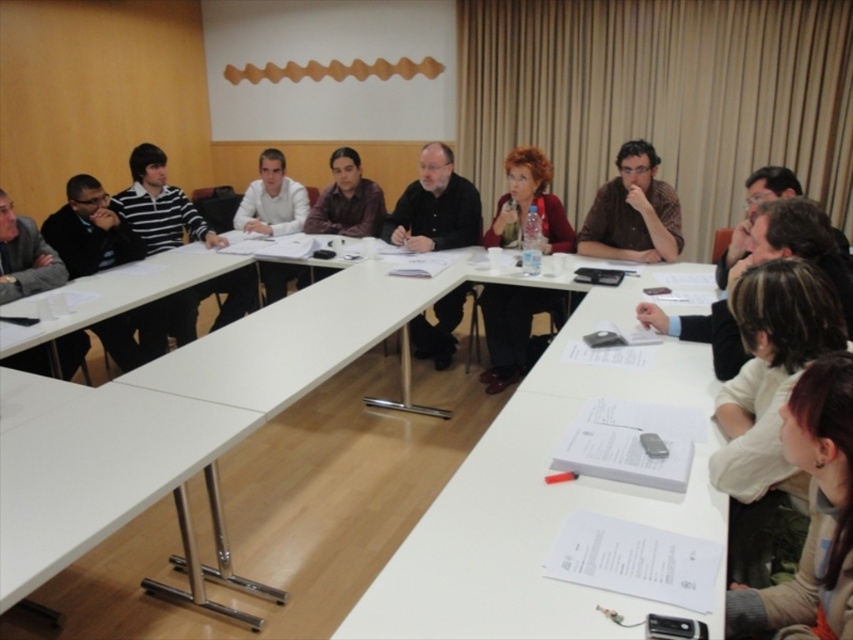
Who is higher up, white glossy table at center or matte black jacket at left?

matte black jacket at left

Is white glossy table at center above matte black jacket at left?

Incorrect, white glossy table at center is not positioned above matte black jacket at left.

Where is `white glossy table at center`? This screenshot has width=853, height=640. white glossy table at center is located at coordinates (303, 342).

At what (x,y) coordinates should I click in order to perform the action: click on white glossy table at center. Please return your answer as a coordinate pair (x, y). This screenshot has width=853, height=640. Looking at the image, I should click on tap(303, 342).

Which is behind, point (814, 369) or point (248, 196)?

The point (248, 196) is behind.

Between white fabric shirt at lower right and white shirt at center, which one has more height?

white shirt at center is taller.

Locate an element on the screen. white fabric shirt at lower right is located at coordinates (811, 515).

Between white plastic table at lower right and matte black jacket at left, which one has more height?

With more height is white plastic table at lower right.

Who is lower down, white plastic table at lower right or matte black jacket at left?

white plastic table at lower right is lower down.

Image resolution: width=853 pixels, height=640 pixels. Find the location of `white plastic table at lower right`. white plastic table at lower right is located at coordinates (540, 502).